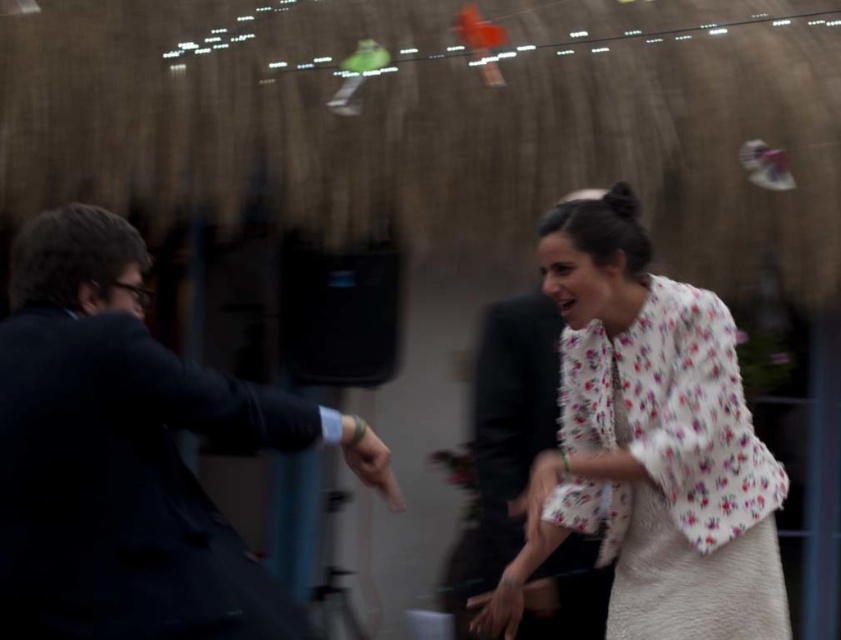
Who is higher up, dark blue suit at left or floral fabric blouse at center?

Positioned higher is dark blue suit at left.

Measure the distance between point (59, 545) and camera.

A distance of 2.21 meters exists between point (59, 545) and camera.

Does point (34, 246) lie behind point (644, 310)?

No, it is in front of (644, 310).

The image size is (841, 640). Identify the location of dark blue suit at left. (120, 454).

Does dark blue suit at left have a larger size compared to white floral blouse at center?

No, dark blue suit at left is not bigger than white floral blouse at center.

What do you see at coordinates (120, 454) in the screenshot?
I see `dark blue suit at left` at bounding box center [120, 454].

Is point (114, 241) closer to camera compared to point (464, 563)?

Yes, point (114, 241) is closer to viewer.

Identify the location of dark blue suit at left. (120, 454).

Does point (500, 563) come behind point (379, 458)?

Yes.

What are the coordinates of `white floral blouse at center` in the screenshot? It's located at (505, 436).